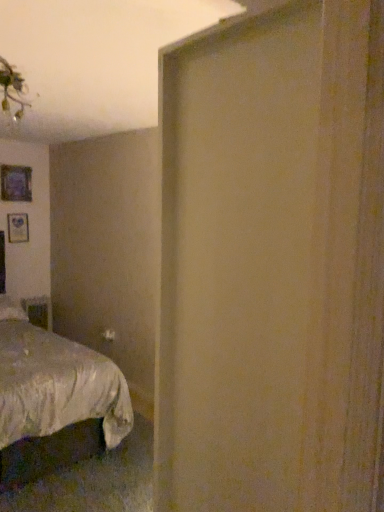
Question: Should I look upward or downward to see silky white bed at lower left?

Choices:
 (A) up
 (B) down

Answer: (B)

Question: Is matte purple picture frame at upper left at the left side of silky white bed at lower left?

Choices:
 (A) yes
 (B) no

Answer: (A)

Question: Is matte purple picture frame at upper left outside silky white bed at lower left?

Choices:
 (A) yes
 (B) no

Answer: (A)

Question: Is silky white bed at lower left surrounded by matte purple picture frame at upper left?

Choices:
 (A) no
 (B) yes

Answer: (A)

Question: Is matte purple picture frame at upper left smaller than silky white bed at lower left?

Choices:
 (A) yes
 (B) no

Answer: (A)

Question: Is matte purple picture frame at upper left facing towards silky white bed at lower left?

Choices:
 (A) yes
 (B) no

Answer: (B)

Question: From the image's perspective, is matte purple picture frame at upper left on silky white bed at lower left?

Choices:
 (A) no
 (B) yes

Answer: (B)

Question: Does silky white bed at lower left have a lesser width compared to matte purple picture frame at upper left?

Choices:
 (A) no
 (B) yes

Answer: (A)

Question: Is silky white bed at lower left next to matte purple picture frame at upper left and touching it?

Choices:
 (A) yes
 (B) no

Answer: (B)

Question: Considering the relative sizes of silky white bed at lower left and matte purple picture frame at upper left in the image provided, is silky white bed at lower left smaller than matte purple picture frame at upper left?

Choices:
 (A) no
 (B) yes

Answer: (A)

Question: Is matte purple picture frame at upper left a part of silky white bed at lower left?

Choices:
 (A) no
 (B) yes

Answer: (A)

Question: From a real-world perspective, is silky white bed at lower left over matte purple picture frame at upper left?

Choices:
 (A) yes
 (B) no

Answer: (B)

Question: Is silky white bed at lower left bigger than matte purple picture frame at upper left?

Choices:
 (A) yes
 (B) no

Answer: (A)

Question: Based on their positions, is matte purple picture frame at upper left located to the left or right of silky white bed at lower left?

Choices:
 (A) right
 (B) left

Answer: (B)